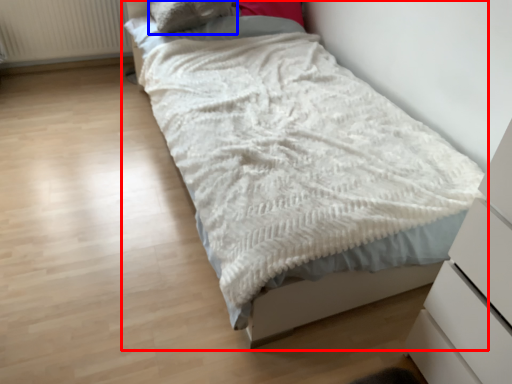
Question: Which object appears farthest to the camera in this image, bed (highlighted by a red box) or pillow (highlighted by a blue box)?

Choices:
 (A) bed
 (B) pillow

Answer: (B)